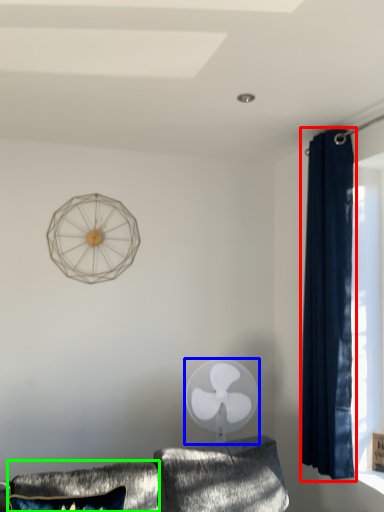
Question: Which object is the farthest from curtain (highlighted by a red box)? Choose among these: mechanical fan (highlighted by a blue box) or pillow (highlighted by a green box).

Choices:
 (A) mechanical fan
 (B) pillow

Answer: (B)